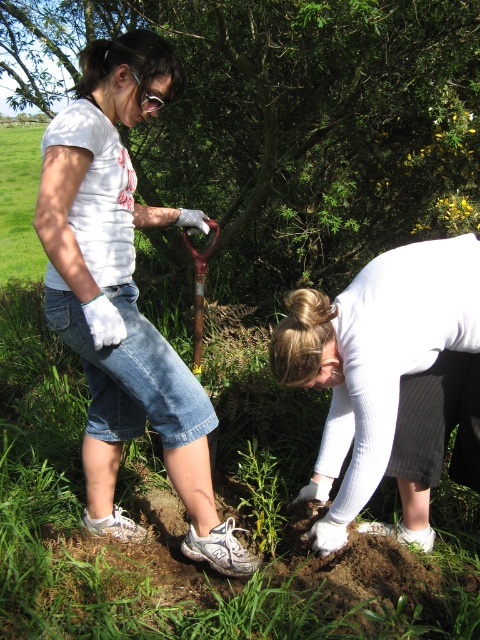
Does white textured sweater at lower center appear under wooden shovel at center?

Indeed, white textured sweater at lower center is positioned under wooden shovel at center.

Does white textured sweater at lower center have a greater height compared to wooden shovel at center?

Yes, white textured sweater at lower center is taller than wooden shovel at center.

Is point (405, 538) farther from camera compared to point (194, 308)?

No, it is not.

You are a GUI agent. You are given a task and a screenshot of the screen. Output one action in this format:
    pyautogui.click(x=<x>, y=<y>)
    Task: Click on the white textured sweater at lower center
    Image resolution: width=480 pixels, height=640 pixels.
    Given the screenshot: What is the action you would take?
    pyautogui.click(x=391, y=380)

Between green matte tree at upper center and white textured sweater at lower center, which one appears on the left side from the viewer's perspective?

Positioned to the left is green matte tree at upper center.

Does point (31, 33) lie in front of point (445, 387)?

No, it is not.

Between point (402, 196) and point (414, 317), which one is positioned behind?

The point (402, 196) is behind.

You are a GUI agent. You are given a task and a screenshot of the screen. Output one action in this format:
    pyautogui.click(x=<x>, y=<y>)
    Task: Click on the green matte tree at upper center
    
    Given the screenshot: What is the action you would take?
    pyautogui.click(x=287, y=120)

Is green matte tree at upper center positioned before white matte t-shirt at upper left?

No, green matte tree at upper center is further to the viewer.

Where is `green matte tree at upper center`? This screenshot has width=480, height=640. green matte tree at upper center is located at coordinates (287, 120).

Which is in front, point (197, 148) or point (115, 468)?

Point (115, 468) is more forward.

Locate an element on the screen. green matte tree at upper center is located at coordinates (287, 120).